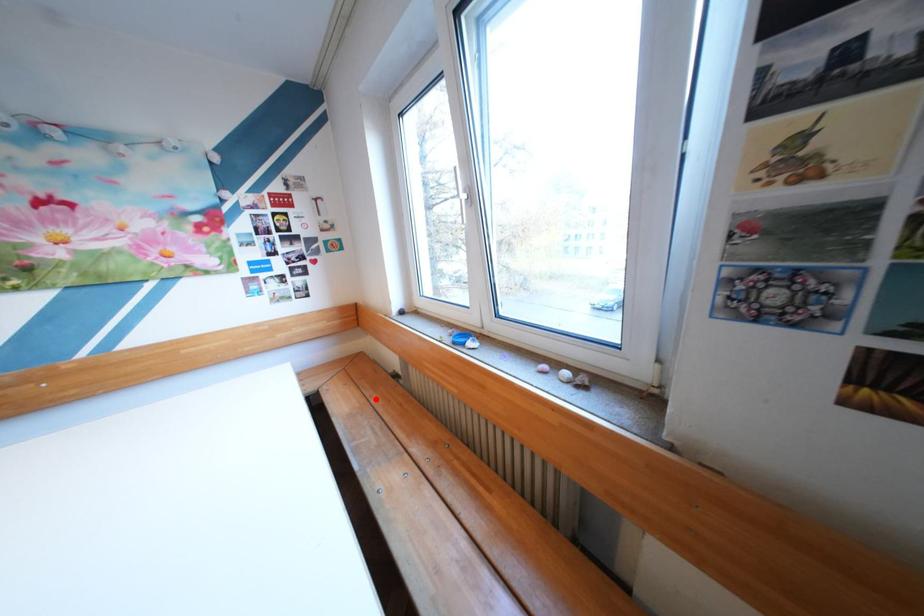
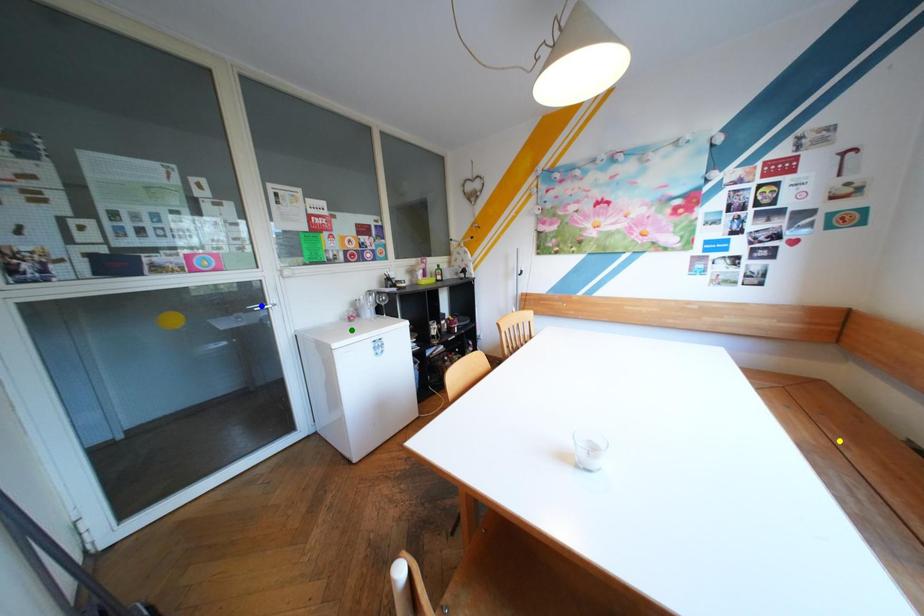
Question: I am providing you with two images of the same scene from different viewpoints. A red point is marked on the first image. You are given multiple points on the second image. Which point in image 2 represents the same 3d spot as the red point in image 1?

Choices:
 (A) yellow point
 (B) blue point
 (C) green point

Answer: (A)